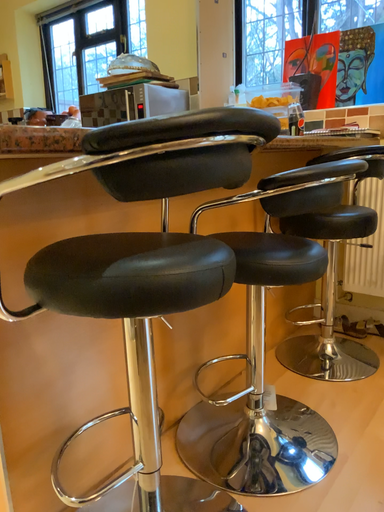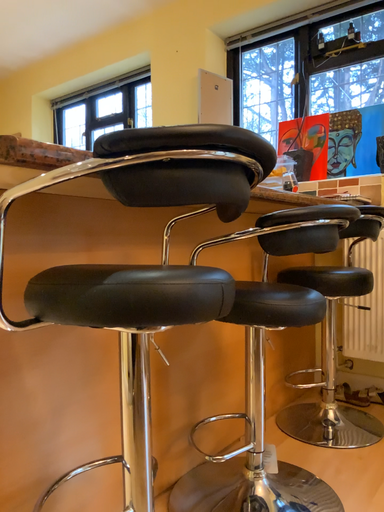
Question: Which way did the camera rotate in the video?

Choices:
 (A) rotated upward
 (B) rotated downward

Answer: (A)